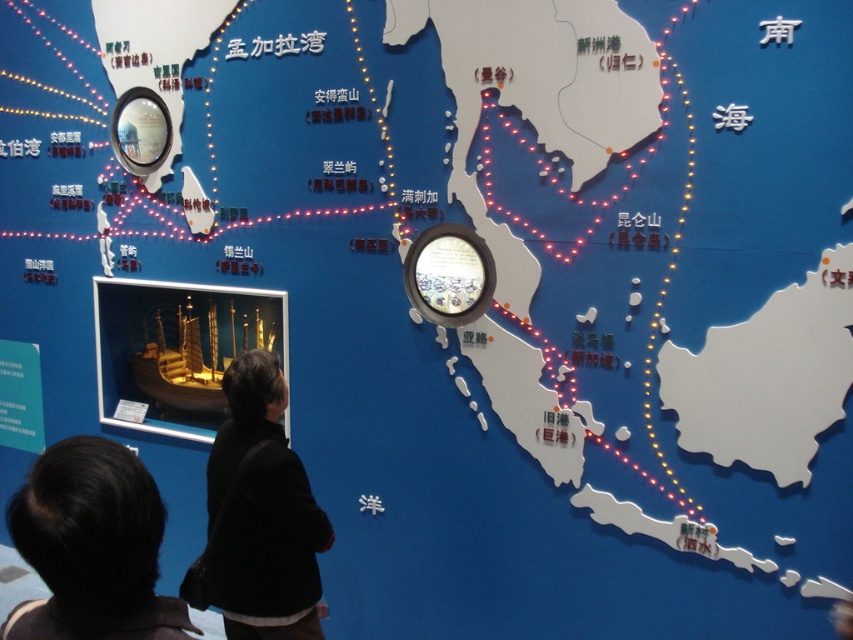
Which is behind, point (67, 456) or point (212, 513)?

Positioned behind is point (212, 513).

The height and width of the screenshot is (640, 853). What do you see at coordinates (91, 547) in the screenshot? I see `black hair at lower left` at bounding box center [91, 547].

Locate an element on the screen. Image resolution: width=853 pixels, height=640 pixels. black hair at lower left is located at coordinates (91, 547).

Does black fabric at lower left come in front of wooden ship at center?

Yes, black fabric at lower left is in front of wooden ship at center.

At what (x,y) coordinates should I click in order to perform the action: click on black fabric at lower left. Please return your answer as a coordinate pair (x, y). Looking at the image, I should click on (258, 515).

The image size is (853, 640). Find the location of `black fabric at lower left`. black fabric at lower left is located at coordinates (258, 515).

Is point (113, 572) positioned before point (125, 292)?

Yes.

Which is in front, point (74, 481) or point (177, 358)?

Point (74, 481) is in front.

This screenshot has width=853, height=640. I want to click on black hair at lower left, so click(91, 547).